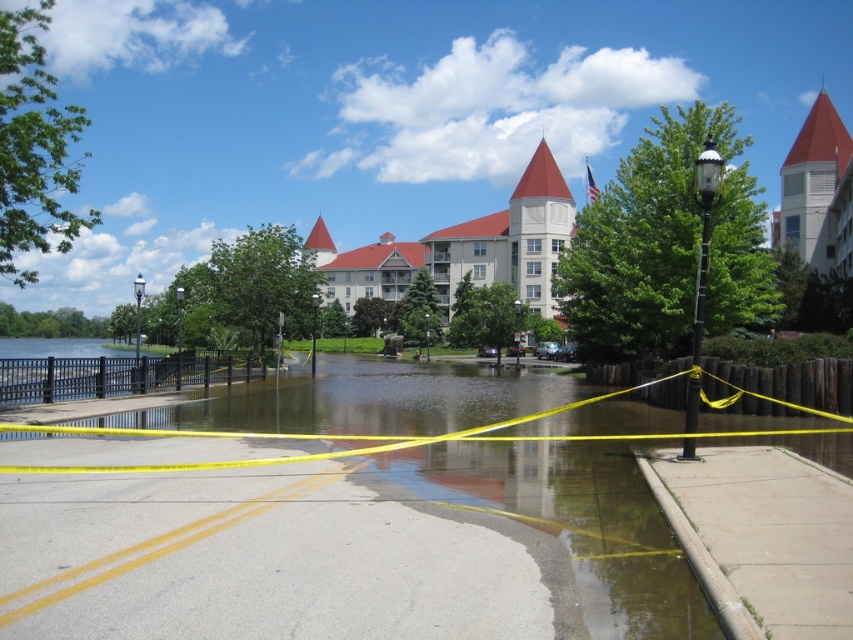
You are a delivery person trying to navigate to the flooded area near the building with red tiles. You see the gray concrete pavement at lower center and the gray concrete sidewalk at lower right. Which path is closer to you and safer to walk on?

The gray concrete pavement at lower center is closer to the viewer than the gray concrete sidewalk at lower right, so it is the safer path to walk on.

You are a delivery person trying to navigate through the flooded area. You see the yellow plastic tape at center and the matte red tower at upper right. Which object is positioned higher from the ground level?

The matte red tower at upper right is positioned higher from the ground level than the yellow plastic tape at center because the yellow plastic tape at center is located below it.